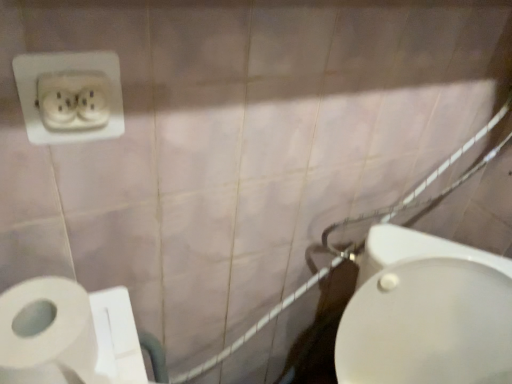
Question: Does white glossy bidet at lower right come behind white ceramic shower at right?

Choices:
 (A) yes
 (B) no

Answer: (B)

Question: Considering the relative sizes of white glossy bidet at lower right and white ceramic shower at right in the image provided, is white glossy bidet at lower right shorter than white ceramic shower at right?

Choices:
 (A) no
 (B) yes

Answer: (A)

Question: From the image's perspective, does white glossy bidet at lower right appear lower than white ceramic shower at right?

Choices:
 (A) no
 (B) yes

Answer: (B)

Question: Is white ceramic shower at right surrounded by white glossy bidet at lower right?

Choices:
 (A) no
 (B) yes

Answer: (A)

Question: Does white glossy bidet at lower right turn towards white ceramic shower at right?

Choices:
 (A) yes
 (B) no

Answer: (B)

Question: From the image's perspective, is white ceramic shower at right located above or below white plastic power plugs and sockets at upper left?

Choices:
 (A) below
 (B) above

Answer: (A)

Question: Is white ceramic shower at right inside the boundaries of white plastic power plugs and sockets at upper left, or outside?

Choices:
 (A) outside
 (B) inside

Answer: (A)

Question: From a real-world perspective, is white ceramic shower at right positioned above or below white plastic power plugs and sockets at upper left?

Choices:
 (A) above
 (B) below

Answer: (B)

Question: From their relative heights in the image, would you say white ceramic shower at right is taller or shorter than white plastic power plugs and sockets at upper left?

Choices:
 (A) tall
 (B) short

Answer: (A)

Question: Is white plastic power plugs and sockets at upper left taller or shorter than white matte toilet paper at lower left?

Choices:
 (A) tall
 (B) short

Answer: (A)

Question: Is white plastic power plugs and sockets at upper left in front of or behind white matte toilet paper at lower left in the image?

Choices:
 (A) behind
 (B) front

Answer: (A)

Question: Based on their positions, is white plastic power plugs and sockets at upper left located to the left or right of white matte toilet paper at lower left?

Choices:
 (A) right
 (B) left

Answer: (B)

Question: From the image's perspective, is white plastic power plugs and sockets at upper left above or below white matte toilet paper at lower left?

Choices:
 (A) below
 (B) above

Answer: (B)

Question: Considering the positions of white glossy bidet at lower right and white ceramic shower at right in the image, is white glossy bidet at lower right bigger or smaller than white ceramic shower at right?

Choices:
 (A) big
 (B) small

Answer: (A)

Question: Considering the positions of point 425,319 and point 339,253, is point 425,319 closer or farther from the camera than point 339,253?

Choices:
 (A) closer
 (B) farther

Answer: (A)